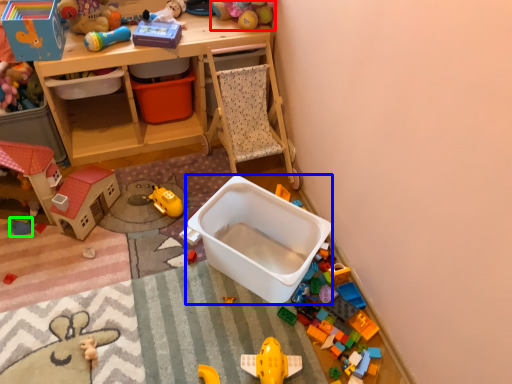
Question: Which object is the closest to the toy (highlighted by a red box)? Choose among these: storage box (highlighted by a blue box) or toy (highlighted by a green box).

Choices:
 (A) storage box
 (B) toy

Answer: (A)